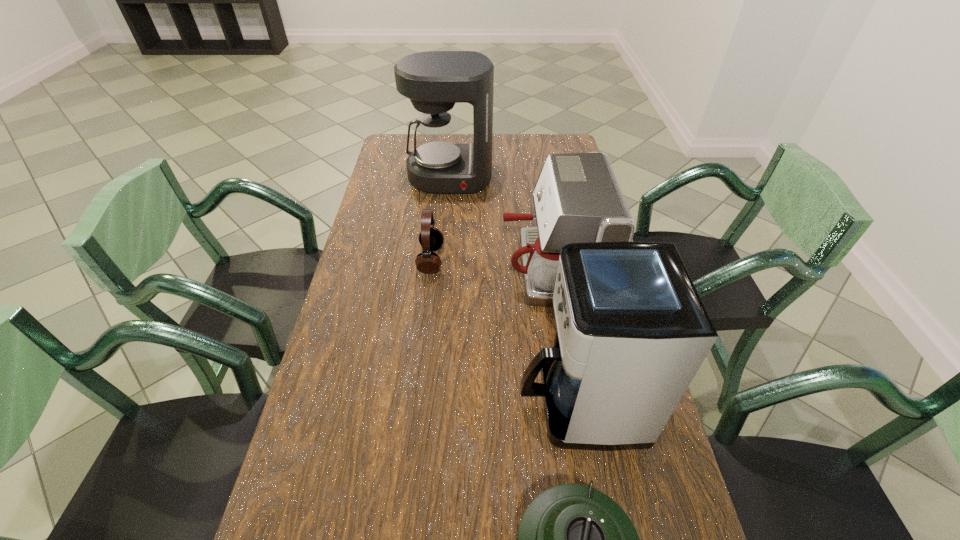
Where is `free spot between the farthest coffee maker and the shortest coffee maker`? free spot between the farthest coffee maker and the shortest coffee maker is located at coordinates (500, 223).

Locate an element on the screen. This screenshot has height=540, width=960. empty space that is in between the headset and the shortest coffee maker is located at coordinates click(491, 264).

In order to click on vacant space that is in between the second nearest coffee maker and the farthest coffee maker in this screenshot , I will do `click(500, 223)`.

At what (x,y) coordinates should I click in order to perform the action: click on free space between the farthest coffee maker and the shortest object. Please return your answer as a coordinate pair (x, y). This screenshot has width=960, height=540. Looking at the image, I should click on (441, 219).

Where is `free point between the farthest object and the second farthest coffee maker`? free point between the farthest object and the second farthest coffee maker is located at coordinates (500, 223).

Locate an element on the screen. This screenshot has height=540, width=960. object identified as the closest to the nearest coffee maker is located at coordinates (573, 539).

Image resolution: width=960 pixels, height=540 pixels. In order to click on object that ranks as the third closest to the farthest object in this screenshot , I will do `click(632, 332)`.

Where is `the closest coffee maker to the lantern`? the closest coffee maker to the lantern is located at coordinates (632, 332).

This screenshot has width=960, height=540. Find the location of `coffee maker that is the second closest one to the nearest object`. coffee maker that is the second closest one to the nearest object is located at coordinates (577, 199).

Locate an element on the screen. vacant point that satisfies the following two spatial constraints: 1. on the button side of the farthest object; 2. on the ear pads of the headset is located at coordinates (443, 260).